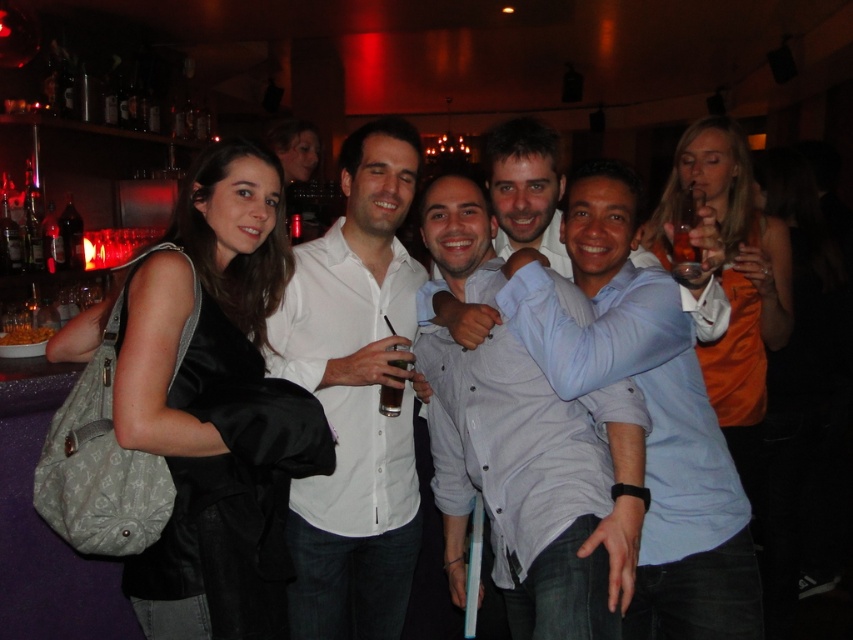
Question: Does white shirt at center appear under orange satin dress at right?

Choices:
 (A) no
 (B) yes

Answer: (B)

Question: Considering the relative positions of matte black jacket at left and translucent plastic cup at center in the image provided, where is matte black jacket at left located with respect to translucent plastic cup at center?

Choices:
 (A) right
 (B) left

Answer: (B)

Question: Can you confirm if white shirt at center is positioned to the right of orange satin dress at right?

Choices:
 (A) no
 (B) yes

Answer: (A)

Question: Which of the following is the farthest from the observer?

Choices:
 (A) translucent plastic cup at center
 (B) matte black jacket at left
 (C) light blue shirt at center

Answer: (A)

Question: Which object is farther from the camera taking this photo?

Choices:
 (A) matte black jacket at left
 (B) white shirt at center
 (C) orange satin dress at right
 (D) translucent plastic cup at center

Answer: (C)

Question: Which is farther from the white shirt at center?

Choices:
 (A) light blue shirt at center
 (B) translucent plastic cup at center
 (C) orange satin dress at right

Answer: (C)